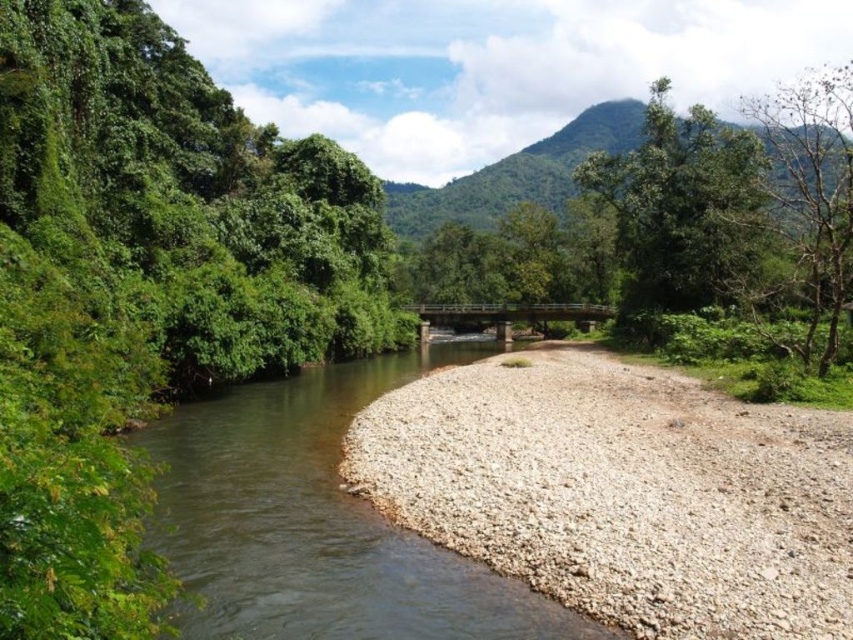
Question: Observing the image, what is the correct spatial positioning of brown gravel river at center in reference to green leafy tree at upper right?

Choices:
 (A) left
 (B) right

Answer: (A)

Question: Considering the relative positions of brown gravel river at center and green leafy mountain at upper center in the image provided, where is brown gravel river at center located with respect to green leafy mountain at upper center?

Choices:
 (A) above
 (B) below

Answer: (B)

Question: Does brown gravel river at center have a greater width compared to green leafy mountain at upper center?

Choices:
 (A) yes
 (B) no

Answer: (B)

Question: Which of these objects is positioned closest to the green leafy tree at upper right?

Choices:
 (A) green leafy tree at left
 (B) green leafy tree at right

Answer: (B)

Question: Which of the following is the closest to the observer?

Choices:
 (A) green leafy tree at right
 (B) green leafy mountain at upper center
 (C) green leafy tree at upper right
 (D) green leafy tree at left

Answer: (D)

Question: Which point is closer to the camera?

Choices:
 (A) green leafy tree at left
 (B) green leafy tree at right
 (C) green leafy tree at upper right

Answer: (A)